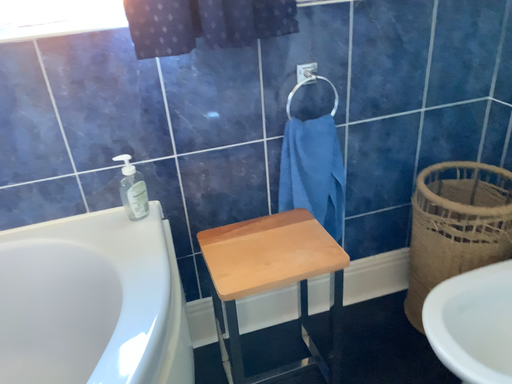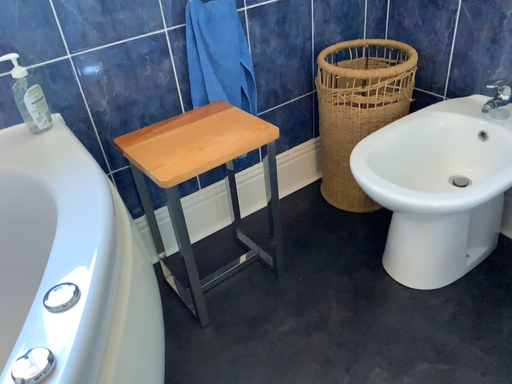
Question: How did the camera likely rotate when shooting the video?

Choices:
 (A) rotated right
 (B) rotated left

Answer: (A)